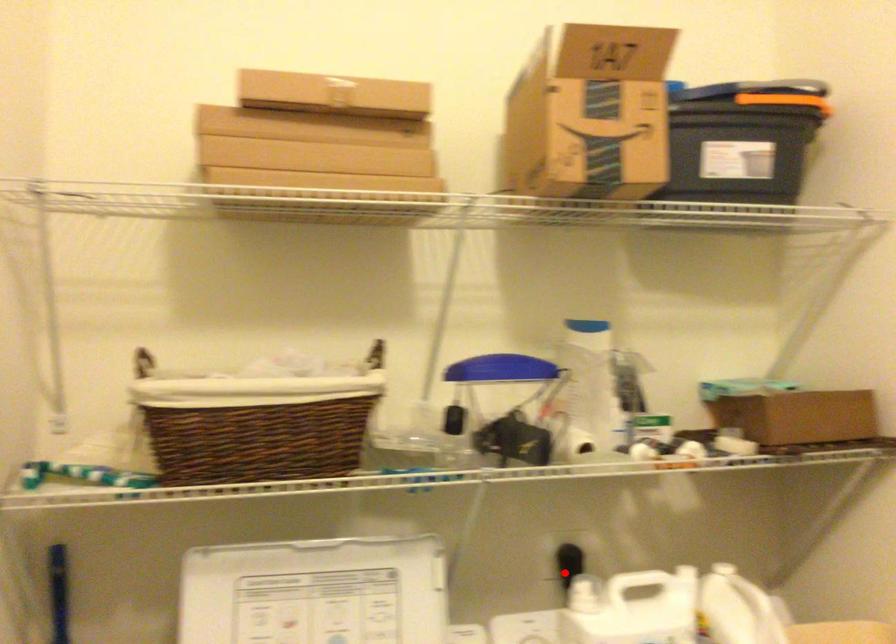
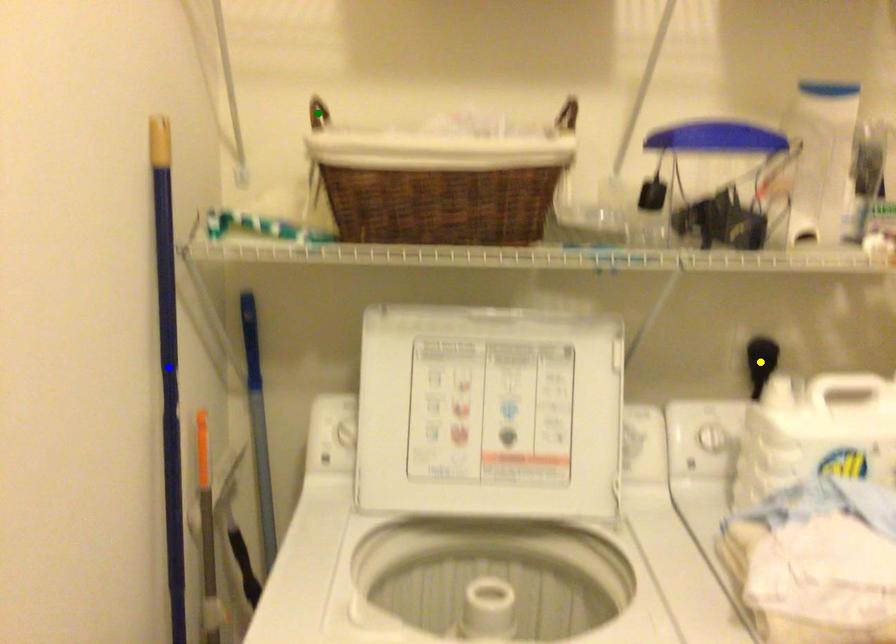
Question: I am providing you with two images of the same scene from different viewpoints. A red point is marked on the first image. You are given multiple points on the second image. Which spot in image 2 lines up with the point in image 1?

Choices:
 (A) yellow point
 (B) green point
 (C) blue point

Answer: (A)